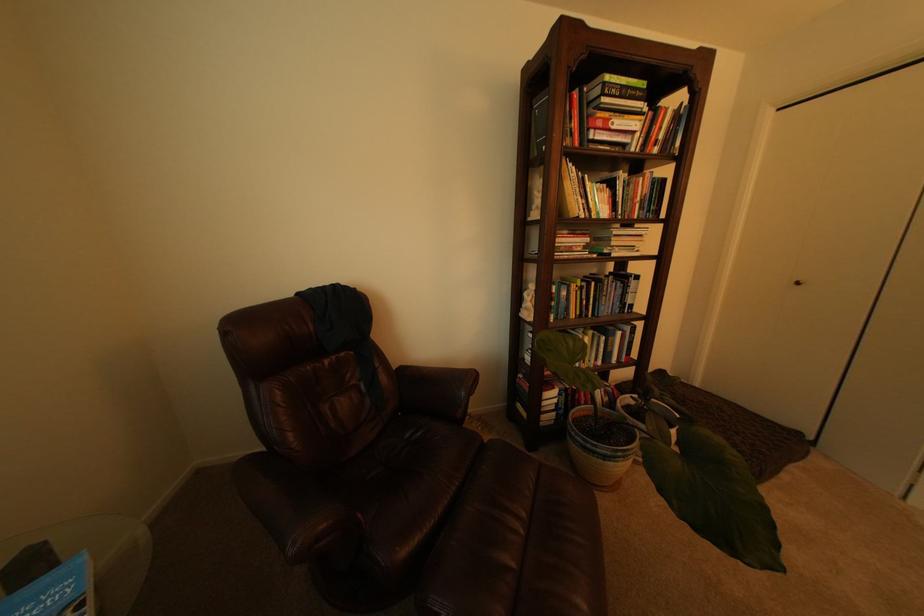
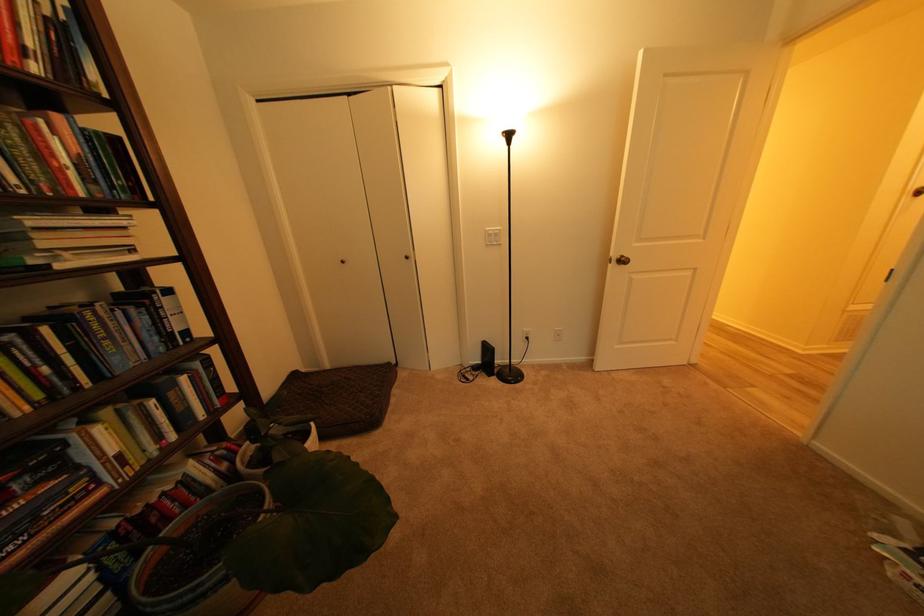
Where in the second image is the point corresponding to pixel 708 386 from the first image?

(338, 368)